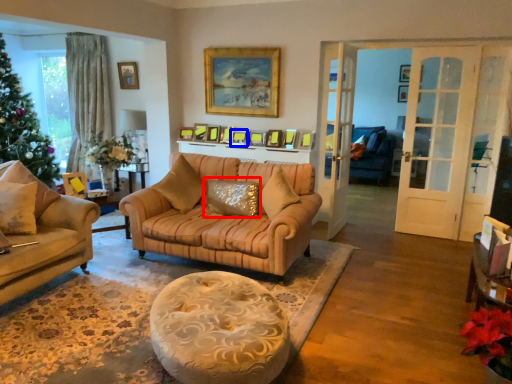
Question: Which object is further to the camera taking this photo, pillow (highlighted by a red box) or picture frame (highlighted by a blue box)?

Choices:
 (A) pillow
 (B) picture frame

Answer: (B)